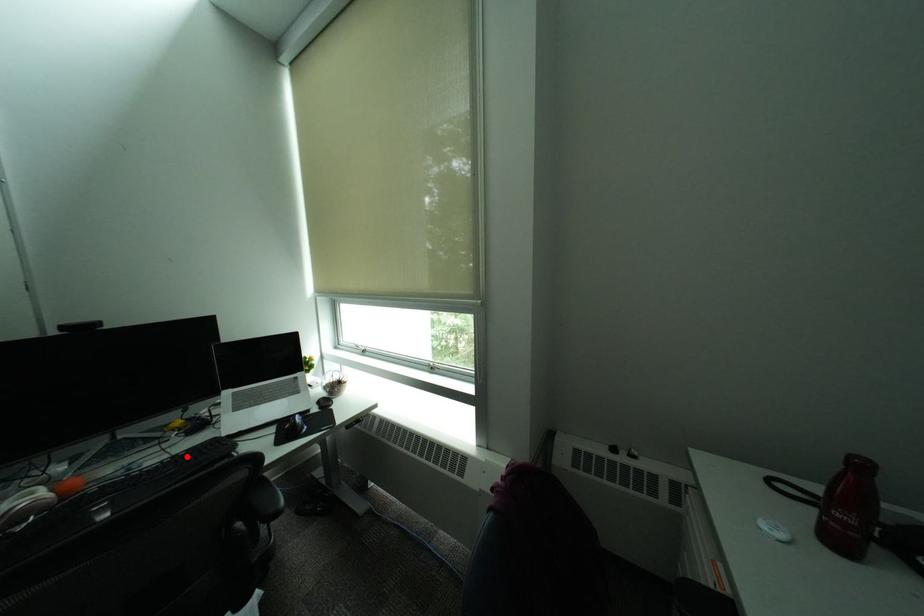
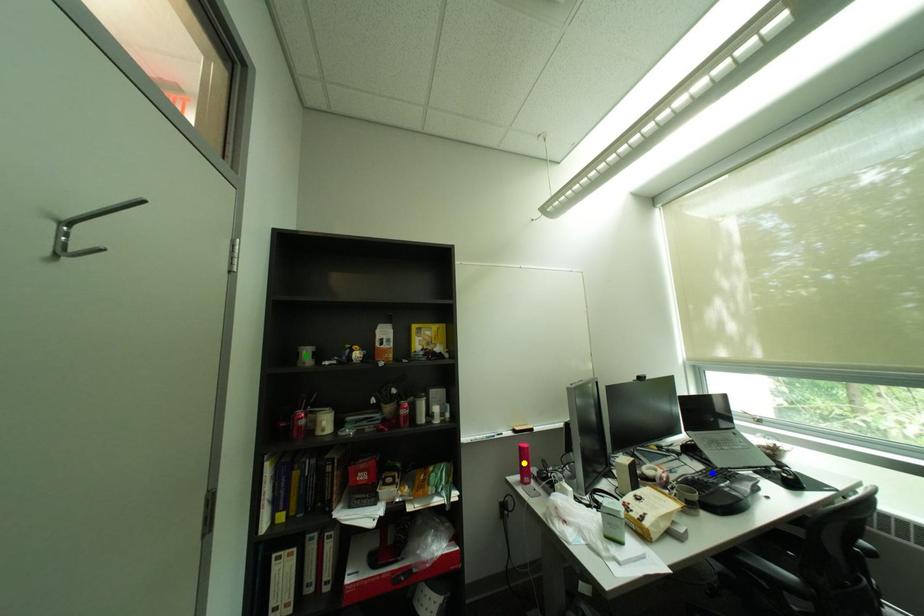
Question: I am providing you with two images of the same scene from different viewpoints. A red point is marked on the first image. You are given multiple points on the second image. Which point in image 2 represents the same 3d spot as the red point in image 1?

Choices:
 (A) green point
 (B) blue point
 (C) yellow point

Answer: (B)